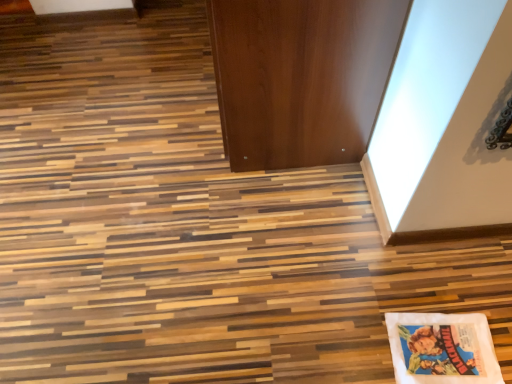
This screenshot has height=384, width=512. What do you see at coordinates (442, 348) in the screenshot?
I see `white paper comic book at lower right` at bounding box center [442, 348].

Where is `white paper comic book at lower right`? white paper comic book at lower right is located at coordinates (442, 348).

This screenshot has height=384, width=512. What are the coordinates of `white paper comic book at lower right` in the screenshot? It's located at (442, 348).